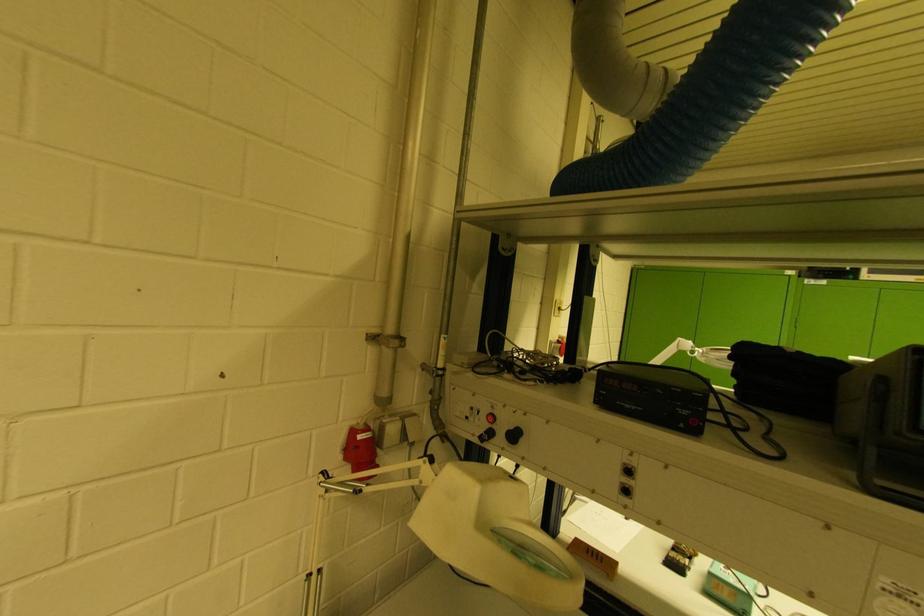
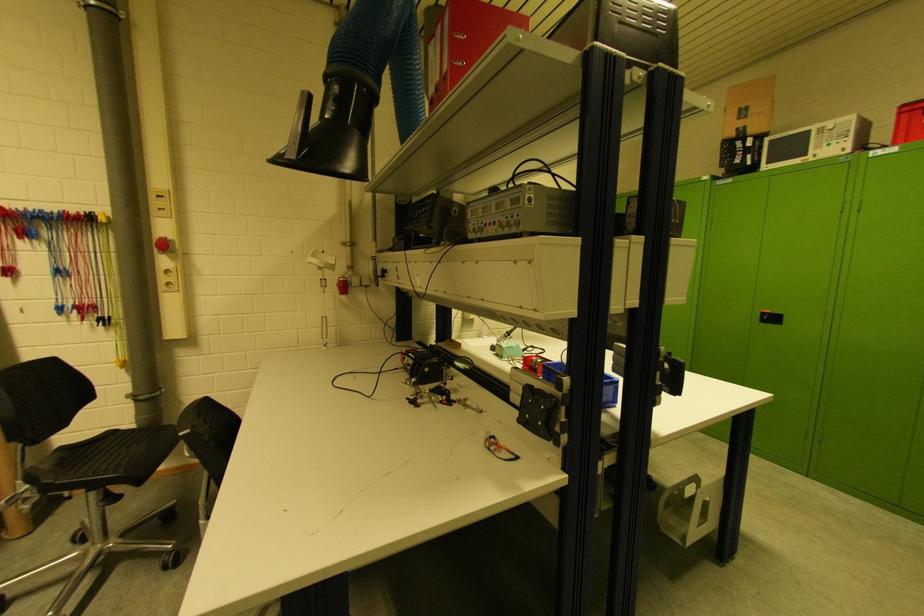
The images are taken continuously from a first-person perspective. In which direction are you moving?

The cameraman moved toward right, backward.